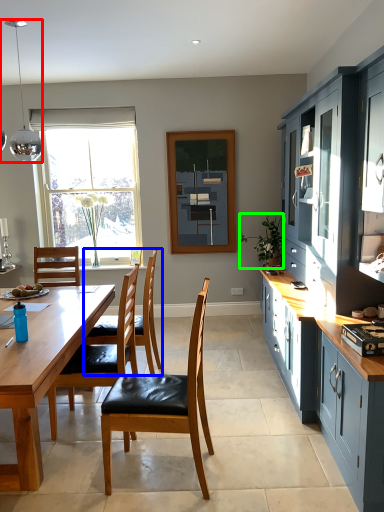
Question: Which object is the closest to the lamp (highlighted by a red box)? Choose among these: chair (highlighted by a blue box) or houseplant (highlighted by a green box).

Choices:
 (A) chair
 (B) houseplant

Answer: (A)